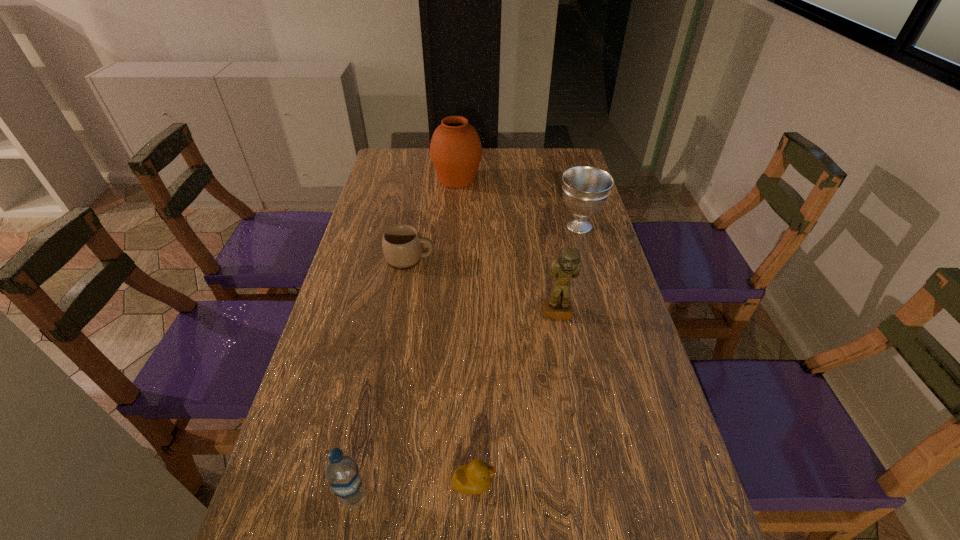
Identify the location of the farthest object. (455, 149).

Where is `figurine`? The image size is (960, 540). figurine is located at coordinates (568, 264).

Locate an element on the screen. This screenshot has height=540, width=960. the fifth object from left to right is located at coordinates (568, 264).

At what (x,y) coordinates should I click in order to perform the action: click on the rightmost object. Please return your answer as a coordinate pair (x, y). The width and height of the screenshot is (960, 540). Looking at the image, I should click on (585, 188).

At what (x,y) coordinates should I click in order to perform the action: click on chalice. Please return your answer as a coordinate pair (x, y). The image size is (960, 540). Looking at the image, I should click on (585, 188).

Locate an element on the screen. The width and height of the screenshot is (960, 540). water bottle is located at coordinates (341, 469).

Where is `the fifth tallest object`? This screenshot has width=960, height=540. the fifth tallest object is located at coordinates (402, 245).

Locate an element on the screen. the fourth nearest object is located at coordinates (402, 245).

Where is `the shortest object`? Image resolution: width=960 pixels, height=540 pixels. the shortest object is located at coordinates pos(474,478).

Where is `blank space located on the front of the farthest object`? The image size is (960, 540). blank space located on the front of the farthest object is located at coordinates (455, 213).